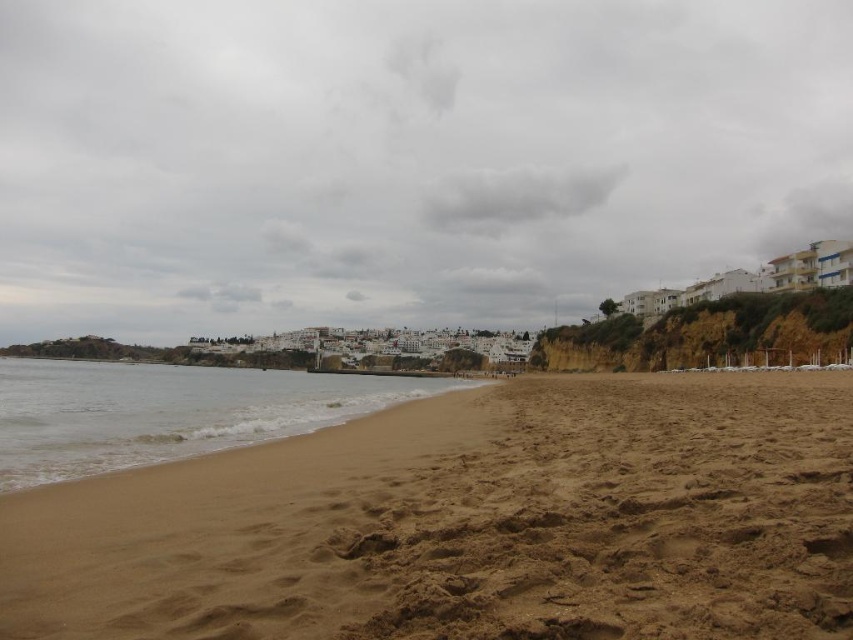
Question: Which is nearer to the brown sandy beach at lower left?

Choices:
 (A) cloudy sky at upper center
 (B) brown sand at lower left

Answer: (B)

Question: Considering the real-world distances, which object is closest to the brown sand at lower left?

Choices:
 (A) brown sandy beach at lower left
 (B) cloudy sky at upper center

Answer: (A)

Question: Which of the following is the farthest from the observer?

Choices:
 (A) (465, 550)
 (B) (169, 374)

Answer: (B)

Question: In this image, where is cloudy sky at upper center located relative to brown sandy beach at lower left?

Choices:
 (A) right
 (B) left

Answer: (B)

Question: Does cloudy sky at upper center lie in front of brown sand at lower left?

Choices:
 (A) yes
 (B) no

Answer: (B)

Question: Can you confirm if cloudy sky at upper center is positioned to the left of brown sandy beach at lower left?

Choices:
 (A) no
 (B) yes

Answer: (B)